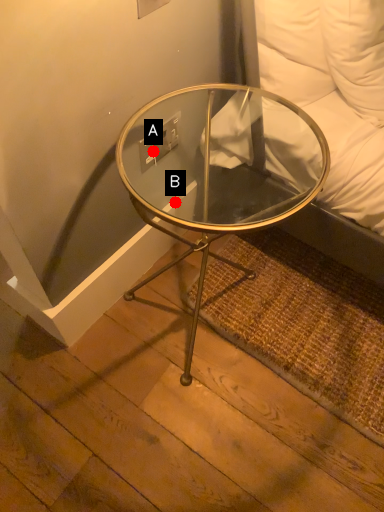
Question: Two points are circled on the image, labeled by A and B beside each circle. Which point is further to the camera?

Choices:
 (A) A is further
 (B) B is further

Answer: (B)